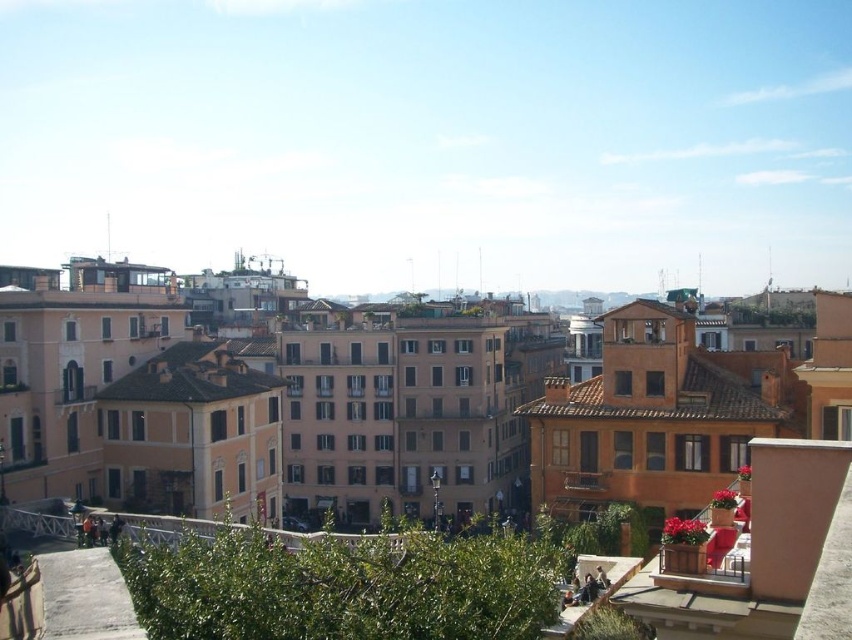
Question: Among these points, which one is farthest from the camera?

Choices:
 (A) (675, 541)
 (B) (208, 522)
 (C) (589, 477)

Answer: (C)

Question: Which object is the closest to the wooden planter at lower right?

Choices:
 (A) wooden at center
 (B) white metal railing at center

Answer: (A)

Question: Which object appears farthest from the camera in this image?

Choices:
 (A) wooden at center
 (B) wooden planter at lower right
 (C) white metal railing at center

Answer: (A)

Question: Does white metal railing at center appear over wooden at center?

Choices:
 (A) no
 (B) yes

Answer: (A)

Question: Is wooden planter at lower right further to camera compared to wooden at center?

Choices:
 (A) no
 (B) yes

Answer: (A)

Question: Where is wooden planter at lower right located in relation to white metal railing at center in the image?

Choices:
 (A) right
 (B) left

Answer: (A)